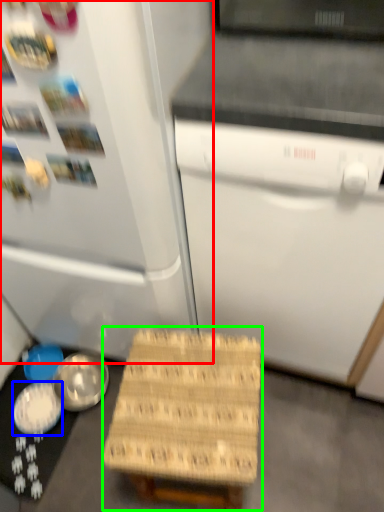
Question: Estimate the real-world distances between objects in this image. Which object is closer to refrigerator (highlighted by a red box), bowl (highlighted by a blue box) or step stool (highlighted by a green box)?

Choices:
 (A) bowl
 (B) step stool

Answer: (B)